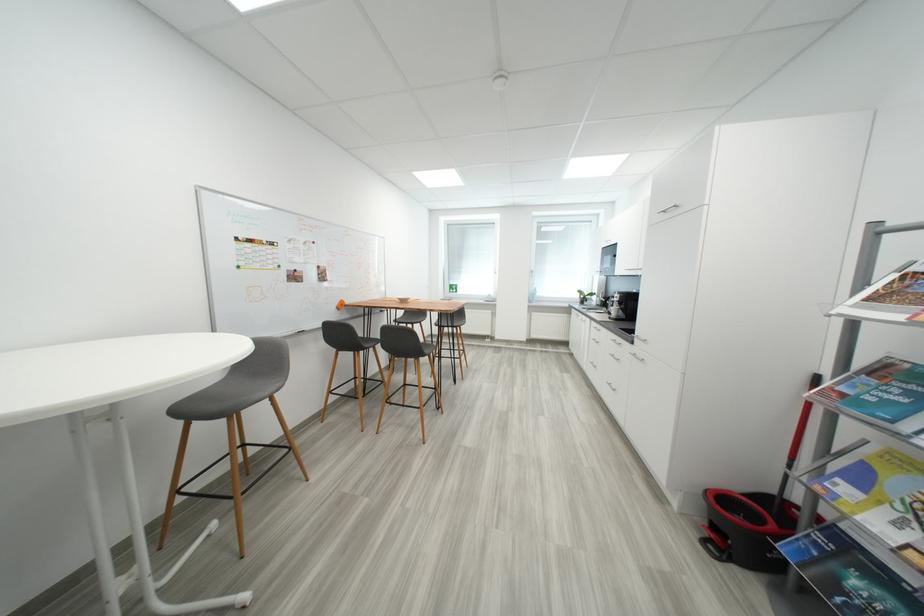
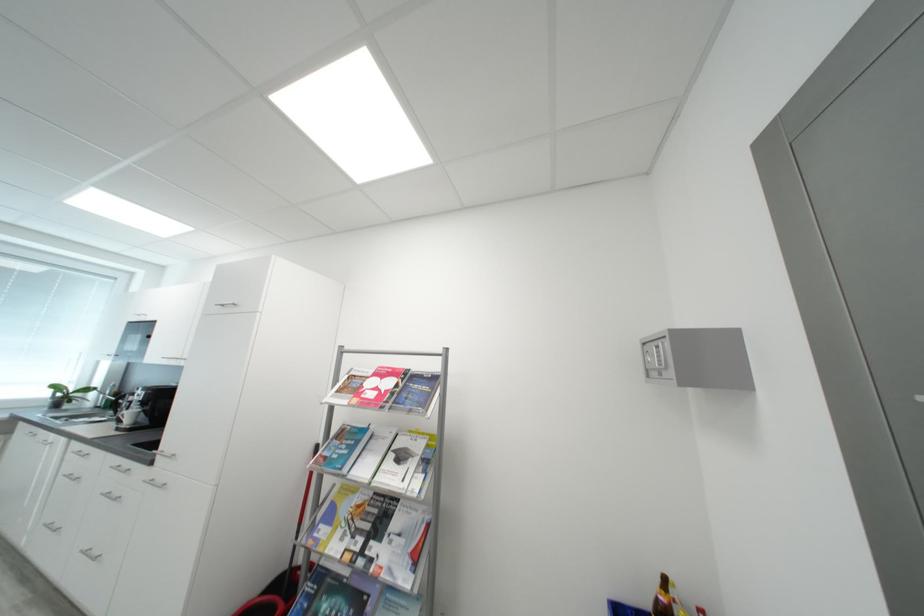
The point at (621, 312) is marked in the first image. Where is the corresponding point in the second image?

(138, 416)